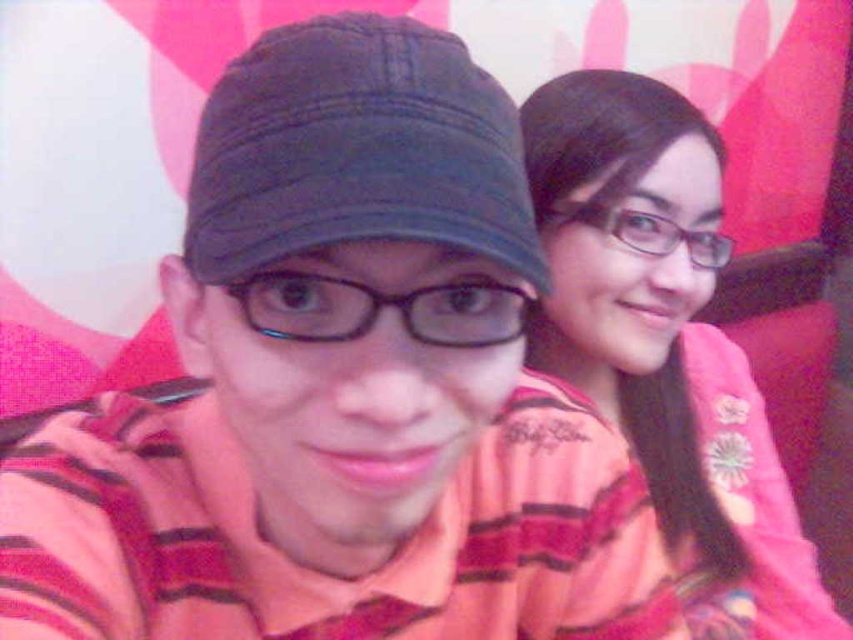
You are a photographer trying to adjust the lighting for a photo shoot. You notice the pink striped shirt at upper right and the dark blue fabric cap at center in the scene. Which object is located to the right of the other?

The pink striped shirt at upper right is positioned on the right side of dark blue fabric cap at center.

You are a photographer trying to capture the best angle of the two people in the image. You notice a specific point at coordinates (665,342) that might be important for framing. Can you identify which part of the image this point corresponds to?

The point at (665,342) corresponds to the pink striped shirt at upper right.

You are a photographer adjusting the camera focus. You notice the pink striped shirt at upper right and the dark blue fabric cap at center. Which object should you focus on first to ensure both are in focus, considering their positions?

The dark blue fabric cap at center is behind the pink striped shirt at upper right, so focusing on the pink striped shirt at upper right first will ensure both are in focus as the cap is further back.